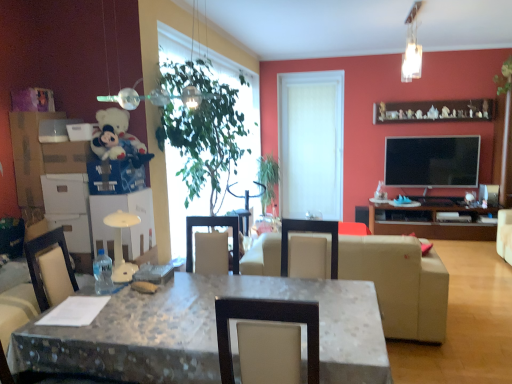
This screenshot has width=512, height=384. What do you see at coordinates (115, 177) in the screenshot?
I see `metallic blue box at upper left, marked as the second box in a left-to-right arrangement` at bounding box center [115, 177].

Measure the distance between point (151, 99) and camera.

The depth of point (151, 99) is 7.12 feet.

What do you see at coordinates (159, 97) in the screenshot? I see `metallic glass pendant light at upper center, which is the second lamp from right to left` at bounding box center [159, 97].

The width and height of the screenshot is (512, 384). What do you see at coordinates (268, 178) in the screenshot? I see `green leafy plant at center, the 1th plant from the bottom` at bounding box center [268, 178].

The width and height of the screenshot is (512, 384). I want to click on wooden figurines at upper right, so click(433, 111).

The height and width of the screenshot is (384, 512). Describe the element at coordinates (433, 111) in the screenshot. I see `wooden figurines at upper right` at that location.

Locate an element on the screen. The image size is (512, 384). flat screen tv at right is located at coordinates (432, 161).

What are the coordinates of `metallic blue box at upper left, marked as the second box in a left-to-right arrangement` in the screenshot? It's located at (115, 177).

Is fluffy white teddy bear at upper left inside the boundaries of marble table at center, or outside?

fluffy white teddy bear at upper left cannot be found inside marble table at center.

Considering the sizes of objects fluffy white teddy bear at upper left and marble table at center in the image provided, who is taller, fluffy white teddy bear at upper left or marble table at center?

marble table at center is taller.

Which of these two, fluffy white teddy bear at upper left or marble table at center, is smaller?

fluffy white teddy bear at upper left.

Is there a large distance between fluffy white teddy bear at upper left and marble table at center?

That's right, there is a large distance between fluffy white teddy bear at upper left and marble table at center.

Which is more to the left, metallic glass pendant light at upper center, which ranks as the first lamp in bottom-to-top order, or marble table at center?

metallic glass pendant light at upper center, which ranks as the first lamp in bottom-to-top order, is more to the left.

Is metallic glass pendant light at upper center, which is the second lamp from right to left, facing away from marble table at center?

metallic glass pendant light at upper center, which is the second lamp from right to left, is not turned away from marble table at center.

Which object is wider, metallic glass pendant light at upper center, positioned as the 1th lamp in left-to-right order, or marble table at center?

With larger width is marble table at center.

How different are the orientations of metallic glass pendant light at upper center, positioned as the 1th lamp in left-to-right order, and marble table at center in degrees?

The angle between the facing direction of metallic glass pendant light at upper center, positioned as the 1th lamp in left-to-right order, and the facing direction of marble table at center is 3.19e-06 degrees.

Is fluffy white teddy bear at upper left oriented towards brown wooden entertainment center at right?

No, fluffy white teddy bear at upper left is not oriented towards brown wooden entertainment center at right.

Based on their sizes in the image, would you say fluffy white teddy bear at upper left is bigger or smaller than brown wooden entertainment center at right?

Considering their sizes, fluffy white teddy bear at upper left takes up less space than brown wooden entertainment center at right.

Is fluffy white teddy bear at upper left not inside brown wooden entertainment center at right?

fluffy white teddy bear at upper left lies outside brown wooden entertainment center at right's area.

Is fluffy white teddy bear at upper left to the left of brown wooden entertainment center at right from the viewer's perspective?

Yes, fluffy white teddy bear at upper left is to the left of brown wooden entertainment center at right.

Between beige leather couch at center and clear plastic bottle at table center, which one has smaller width?

Thinner between the two is clear plastic bottle at table center.

In the scene shown: Considering the relative sizes of beige leather couch at center and clear plastic bottle at table center in the image provided, is beige leather couch at center bigger than clear plastic bottle at table center?

Correct, beige leather couch at center is larger in size than clear plastic bottle at table center.

This screenshot has height=384, width=512. I want to click on studio couch on the right of clear plastic bottle at table center, so click(400, 284).

From the image's perspective, is fluffy white teddy bear at upper left located above or below white matte door at center?

From the image's perspective, fluffy white teddy bear at upper left appears below white matte door at center.

Is the surface of fluffy white teddy bear at upper left in direct contact with white matte door at center?

No, fluffy white teddy bear at upper left is not with white matte door at center.

At what (x,y) coordinates should I click in order to perform the action: click on window screen lying above the fluffy white teddy bear at upper left (from the image's perspective). Please return your answer as a coordinate pair (x, y). Image resolution: width=512 pixels, height=384 pixels. Looking at the image, I should click on (311, 144).

Is green leafy plant at center oriented away from beige leather couch at center?

No, green leafy plant at center is not facing away from beige leather couch at center.

Does green leafy plant at center have a smaller size compared to beige leather couch at center?

No, green leafy plant at center is not smaller than beige leather couch at center.

Which is more to the left, green leafy plant at center or beige leather couch at center?

green leafy plant at center is more to the left.

Are green leafy plant at center and beige leather couch at center beside each other?

No.

Is point (234, 100) closer to viewer compared to point (112, 150)?

No, it is not.

Is green leafy plant at center completely or partially outside of fluffy white teddy bear at upper left?

green leafy plant at center lies outside fluffy white teddy bear at upper left's area.

Can you confirm if green leafy plant at center is positioned to the right of fluffy white teddy bear at upper left?

Yes, green leafy plant at center is to the right of fluffy white teddy bear at upper left.

From the image's perspective, is green leafy plant at center located above fluffy white teddy bear at upper left?

No.

Locate an element on the screen. Image resolution: width=512 pixels, height=384 pixels. desk below the fluffy white teddy bear at upper left (from a real-world perspective) is located at coordinates (205, 332).

At what (x,y) coordinates should I click in order to perform the action: click on the 1st lamp positioned above the marble table at center (from the image's perspective). Please return your answer as a coordinate pair (x, y). The image size is (512, 384). Looking at the image, I should click on (159, 97).

When comparing their distances from translucent glass pendant light at upper right, positioned as the 2th lamp in front-to-back order, does metallic blue box at upper left, positioned as the first box in right-to-left order, or metallic glass pendant light at upper center, positioned as the 1th lamp in left-to-right order, seem closer?

Among the two, metallic glass pendant light at upper center, positioned as the 1th lamp in left-to-right order, is located nearer to translucent glass pendant light at upper right, positioned as the 2th lamp in front-to-back order.

Considering their positions, is clear plastic bottle at table center positioned closer to wooden figurines at upper right than white matte door at center?

The object closer to wooden figurines at upper right is white matte door at center.

Looking at this image, based on their spatial positions, is metallic blue box at upper left, marked as the second box in a left-to-right arrangement, or green leafy plant at upper right, the 2th plant viewed from the left, further from fluffy white teddy bear at upper left?

green leafy plant at upper right, the 2th plant viewed from the left.

Looking at the image, which one is located closer to translucent glass pendant light at upper right, placed as the 2th lamp when sorted from left to right, fluffy white teddy bear at upper left or metallic glass pendant light at upper center, positioned as the 1th lamp in left-to-right order?

metallic glass pendant light at upper center, positioned as the 1th lamp in left-to-right order, is closer to translucent glass pendant light at upper right, placed as the 2th lamp when sorted from left to right.

Estimate the real-world distances between objects in this image. Which object is further from marble table at center, matte cardboard box at left, placed as the second box when sorted from right to left, or green leafy plant at center, the 1th plant from the bottom?

green leafy plant at center, the 1th plant from the bottom, is positioned further to the anchor marble table at center.

Based on the photo, from the image, which object appears to be farther from metallic glass pendant light at upper center, which is the second lamp from right to left, marble table at center or translucent glass pendant light at upper right, positioned as the first lamp in top-to-bottom order?

translucent glass pendant light at upper right, positioned as the first lamp in top-to-bottom order.

Based on their spatial positions, is clear plastic bottle at table center or metallic blue box at upper left, marked as the second box in a left-to-right arrangement, closer to green leafy plant at center, the 1th plant from the bottom?

metallic blue box at upper left, marked as the second box in a left-to-right arrangement, is positioned closer to the anchor green leafy plant at center, the 1th plant from the bottom.

Estimate the real-world distances between objects in this image. Which object is closer to wooden figurines at upper right, green leafy plant at center, arranged as the first plant when viewed from the back, or brown wooden entertainment center at right?

brown wooden entertainment center at right.

Where is `houseplant between marble table at center and translucent glass pendant light at upper right, positioned as the first lamp in top-to-bottom order, along the z-axis`? The height and width of the screenshot is (384, 512). houseplant between marble table at center and translucent glass pendant light at upper right, positioned as the first lamp in top-to-bottom order, along the z-axis is located at coordinates (203, 132).

This screenshot has width=512, height=384. Find the location of `television between metallic blue box at upper left, positioned as the first box in right-to-left order, and white matte door at center in the front-back direction`. television between metallic blue box at upper left, positioned as the first box in right-to-left order, and white matte door at center in the front-back direction is located at coordinates (432, 161).

Locate an element on the screen. Image resolution: width=512 pixels, height=384 pixels. entertainment center between green leafy plant at center and flat screen tv at right from front to back is located at coordinates (432, 220).

The image size is (512, 384). Find the location of `television between green leafy plant at center and green leafy plant at upper right, the second plant in the bottom-to-top sequence, in the horizontal direction`. television between green leafy plant at center and green leafy plant at upper right, the second plant in the bottom-to-top sequence, in the horizontal direction is located at coordinates (432, 161).